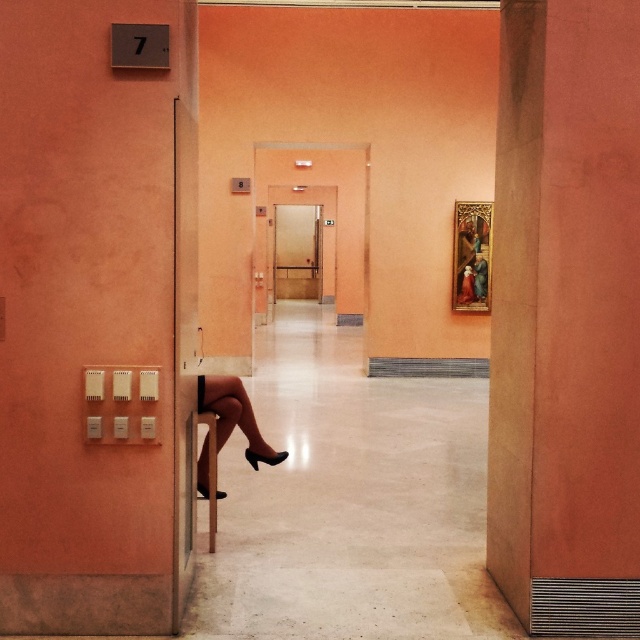
Question: Does smooth orange wall at center have a larger size compared to metallic elevator at center?

Choices:
 (A) no
 (B) yes

Answer: (A)

Question: Which of these objects is positioned closest to the matte black legs at lower left?

Choices:
 (A) metallic elevator at center
 (B) smooth orange wall at center

Answer: (B)

Question: Which of the following is the closest to the observer?

Choices:
 (A) (221, 401)
 (B) (625, 193)

Answer: (B)

Question: Which object is positioned farthest from the matte black legs at lower left?

Choices:
 (A) smooth orange wall at center
 (B) metallic elevator at center

Answer: (B)

Question: Can you confirm if smooth orange wall at center is thinner than metallic elevator at center?

Choices:
 (A) yes
 (B) no

Answer: (A)

Question: Is metallic elevator at center thinner than matte black legs at lower left?

Choices:
 (A) yes
 (B) no

Answer: (B)